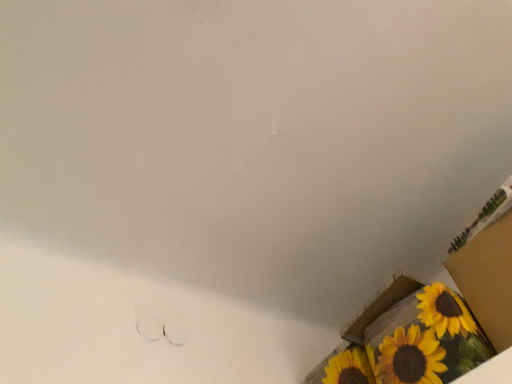
Question: Is cardboard box at lower right, marked as the 1th cardboard box in a top-to-bottom arrangement, spatially inside yellow painted cardboard box at lower right, the 2th cardboard box positioned from the top, or outside of it?

Choices:
 (A) outside
 (B) inside

Answer: (A)

Question: Considering the positions of point (493, 274) and point (432, 309), is point (493, 274) closer or farther from the camera than point (432, 309)?

Choices:
 (A) farther
 (B) closer

Answer: (B)

Question: From a real-world perspective, relative to yellow painted cardboard box at lower right, the 2th cardboard box positioned from the top, is cardboard box at lower right, marked as the 1th cardboard box in a top-to-bottom arrangement, vertically above or below?

Choices:
 (A) below
 (B) above

Answer: (B)

Question: Looking at the image, does yellow painted cardboard box at lower right, the 2th cardboard box positioned from the top, seem bigger or smaller compared to cardboard box at lower right, the 2th cardboard box when ordered from bottom to top?

Choices:
 (A) small
 (B) big

Answer: (B)

Question: From the image's perspective, relative to cardboard box at lower right, the 2th cardboard box when ordered from bottom to top, is yellow painted cardboard box at lower right, which ranks as the 1th cardboard box in bottom-to-top order, above or below?

Choices:
 (A) below
 (B) above

Answer: (A)

Question: Relative to cardboard box at lower right, marked as the 1th cardboard box in a top-to-bottom arrangement, is yellow painted cardboard box at lower right, which ranks as the 1th cardboard box in bottom-to-top order, in front or behind?

Choices:
 (A) front
 (B) behind

Answer: (B)

Question: Is yellow painted cardboard box at lower right, the 2th cardboard box positioned from the top, spatially inside cardboard box at lower right, marked as the 1th cardboard box in a top-to-bottom arrangement, or outside of it?

Choices:
 (A) outside
 (B) inside

Answer: (A)